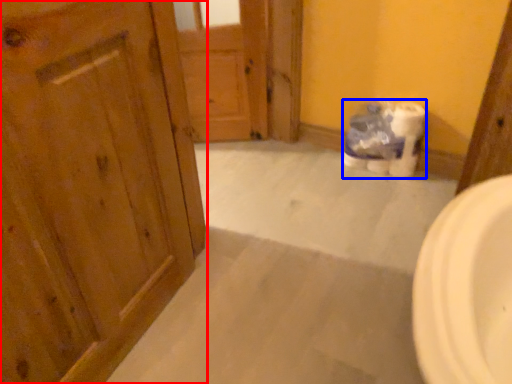
Question: Which point is further to the camera, door (highlighted by a red box) or toilet paper (highlighted by a blue box)?

Choices:
 (A) door
 (B) toilet paper

Answer: (B)